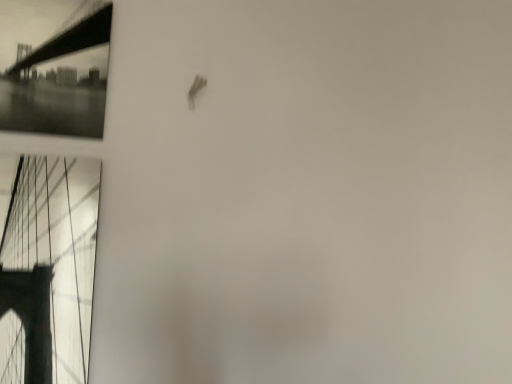
Identify the location of black glossy bridge at upper left. This screenshot has width=512, height=384. (70, 40).

Describe the element at coordinates (70, 40) in the screenshot. I see `black glossy bridge at upper left` at that location.

What do you see at coordinates (48, 270) in the screenshot? I see `metallic bridge at left` at bounding box center [48, 270].

What is the approximate height of metallic bridge at left?

18.99 inches.

Image resolution: width=512 pixels, height=384 pixels. I want to click on metallic bridge at left, so click(x=48, y=270).

Find the location of a particular element. black glossy bridge at upper left is located at coordinates (70, 40).

Consider the image. Considering the relative positions of black glossy bridge at upper left and metallic bridge at left in the image provided, is black glossy bridge at upper left to the right of metallic bridge at left from the viewer's perspective?

No.

Is black glossy bridge at upper left further to camera compared to metallic bridge at left?

Yes, black glossy bridge at upper left is further from the camera.

Which point is more forward, (109,34) or (47,207)?

The point (47,207) is in front.

From the image's perspective, does black glossy bridge at upper left appear lower than metallic bridge at left?

No.

From a real-world perspective, is black glossy bridge at upper left positioned under metallic bridge at left based on gravity?

Actually, black glossy bridge at upper left is physically above metallic bridge at left in the real world.

Which of these two, black glossy bridge at upper left or metallic bridge at left, is thinner?

Thinner between the two is black glossy bridge at upper left.

In the scene shown: Between black glossy bridge at upper left and metallic bridge at left, which one has less height?

black glossy bridge at upper left.

Looking at this image, between black glossy bridge at upper left and metallic bridge at left, which one has larger size?

With larger size is metallic bridge at left.

Is black glossy bridge at upper left spatially inside metallic bridge at left, or outside of it?

black glossy bridge at upper left is located beyond the bounds of metallic bridge at left.

Is black glossy bridge at upper left touching metallic bridge at left?

No, black glossy bridge at upper left is not touching metallic bridge at left.

Is black glossy bridge at upper left looking in the opposite direction of metallic bridge at left?

That's not correct — black glossy bridge at upper left is not looking away from metallic bridge at left.

How many degrees apart are the facing directions of black glossy bridge at upper left and metallic bridge at left?

black glossy bridge at upper left and metallic bridge at left are facing 0.000104 degrees away from each other.

Locate an element on the screen. This screenshot has height=384, width=512. window in front of the black glossy bridge at upper left is located at coordinates (48, 270).

Is metallic bridge at left to the left or to the right of black glossy bridge at upper left in the image?

From the image, it's evident that metallic bridge at left is to the right of black glossy bridge at upper left.

Is metallic bridge at left further to camera compared to black glossy bridge at upper left?

No, metallic bridge at left is closer to the viewer.

Which point is more distant from viewer, (79, 163) or (77, 32)?

The point (77, 32) is behind.

From the image's perspective, which one is positioned lower, metallic bridge at left or black glossy bridge at upper left?

metallic bridge at left appears lower in the image.

From a real-world perspective, is metallic bridge at left below black glossy bridge at upper left?

Yes.

Does metallic bridge at left have a lesser width compared to black glossy bridge at upper left?

In fact, metallic bridge at left might be wider than black glossy bridge at upper left.

Which of these two, metallic bridge at left or black glossy bridge at upper left, stands taller?

Standing taller between the two is metallic bridge at left.

Which of these two, metallic bridge at left or black glossy bridge at upper left, is smaller?

With smaller size is black glossy bridge at upper left.

Is black glossy bridge at upper left completely or partially inside metallic bridge at left?

No, black glossy bridge at upper left is not surrounded by metallic bridge at left.

Does metallic bridge at left touch black glossy bridge at upper left?

metallic bridge at left and black glossy bridge at upper left are clearly separated.

Is metallic bridge at left positioned with its back to black glossy bridge at upper left?

No, black glossy bridge at upper left is not at the back of metallic bridge at left.

What's the angular difference between metallic bridge at left and black glossy bridge at upper left's facing directions?

The facing directions of metallic bridge at left and black glossy bridge at upper left are 0.000104 degrees apart.

Locate an element on the screen. The height and width of the screenshot is (384, 512). suspension bridge behind the metallic bridge at left is located at coordinates (70, 40).

Locate an element on the screen. window below the black glossy bridge at upper left (from a real-world perspective) is located at coordinates tap(48, 270).

What are the coordinates of `suspension bridge above the metallic bridge at left (from the image's perspective)` in the screenshot? It's located at (70, 40).